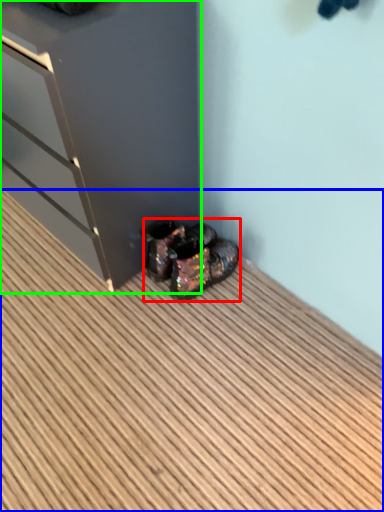
Question: Estimate the real-world distances between objects in this image. Which object is closer to footwear (highlighted by a red box), hardwood (highlighted by a blue box) or dresser (highlighted by a green box)?

Choices:
 (A) hardwood
 (B) dresser

Answer: (B)